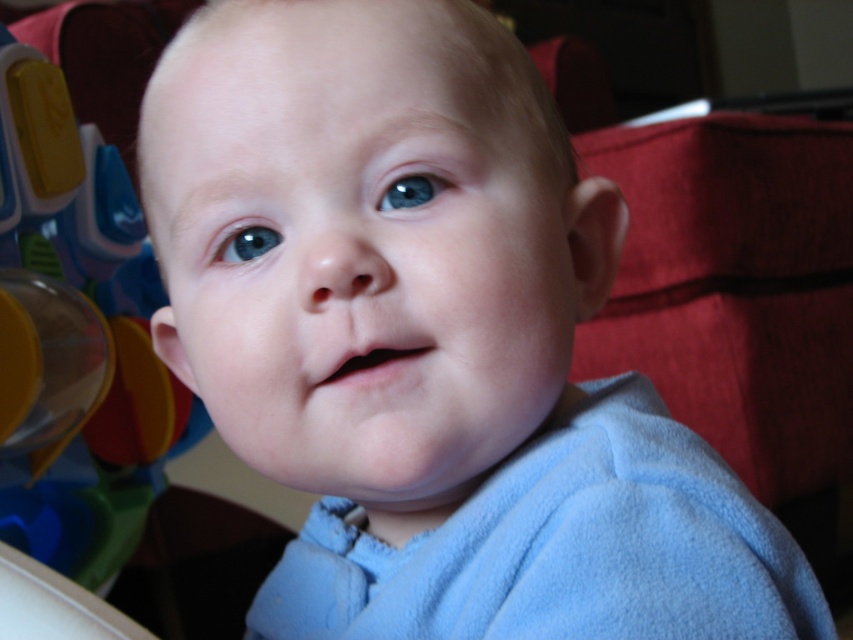
You are a photographer adjusting the lighting in the studio. You need to ensure that the transparent plastic toy at left and the blue glossy eye at center are both well lit. Based on their positions, which object should you adjust the light towards first to ensure proper illumination?

The transparent plastic toy at left is located below the blue glossy eye at center, so you should adjust the light towards the transparent plastic toy at left first to ensure it receives adequate illumination before the upper positioned blue glossy eye at center.